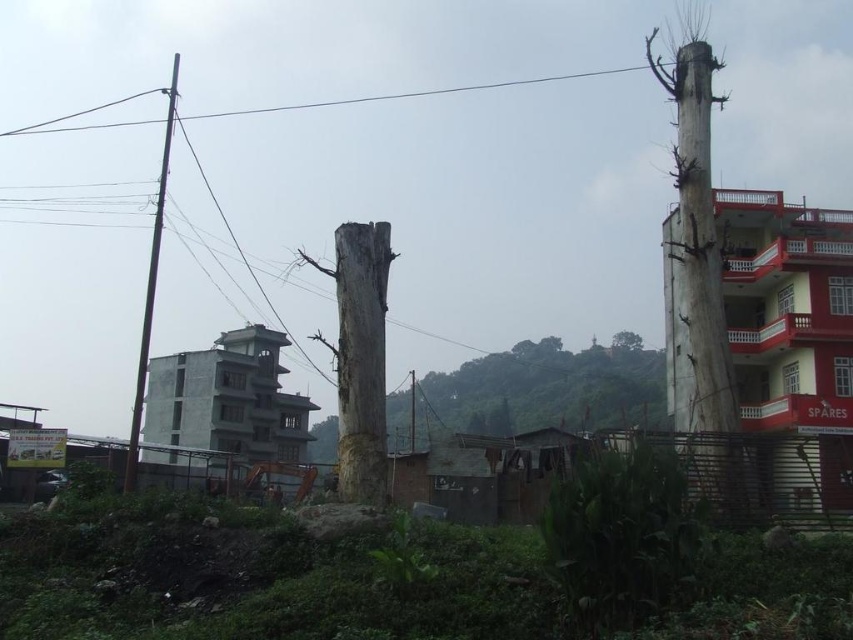
Question: Which point is farther to the camera?

Choices:
 (A) metallic wire at upper center
 (B) smooth gray tree trunk at center
 (C) gray rough tree trunk at center

Answer: (A)

Question: In this image, where is gray rough tree trunk at center located relative to brown wooden telegraph pole at left?

Choices:
 (A) above
 (B) below

Answer: (B)

Question: Does smooth gray tree trunk at center have a lesser width compared to brown wooden telegraph pole at left?

Choices:
 (A) no
 (B) yes

Answer: (B)

Question: Among these objects, which one is nearest to the camera?

Choices:
 (A) smooth gray tree trunk at center
 (B) gray rough tree trunk at center

Answer: (B)

Question: Is metallic wire at upper center above brown wooden telegraph pole at left?

Choices:
 (A) yes
 (B) no

Answer: (A)

Question: Which point is closer to the camera?

Choices:
 (A) metallic wire at upper center
 (B) gray rough tree trunk at center
 (C) brown wooden telegraph pole at left
 (D) smooth gray tree trunk at center

Answer: (B)